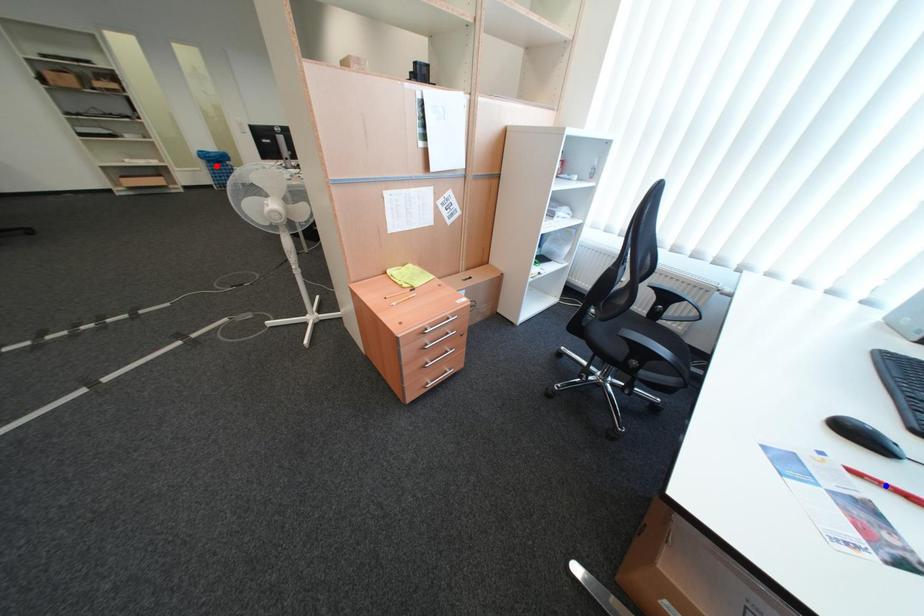
Question: Which of the two points in the image is closer to the camera?

Choices:
 (A) Blue point is closer.
 (B) Red point is closer.

Answer: (A)